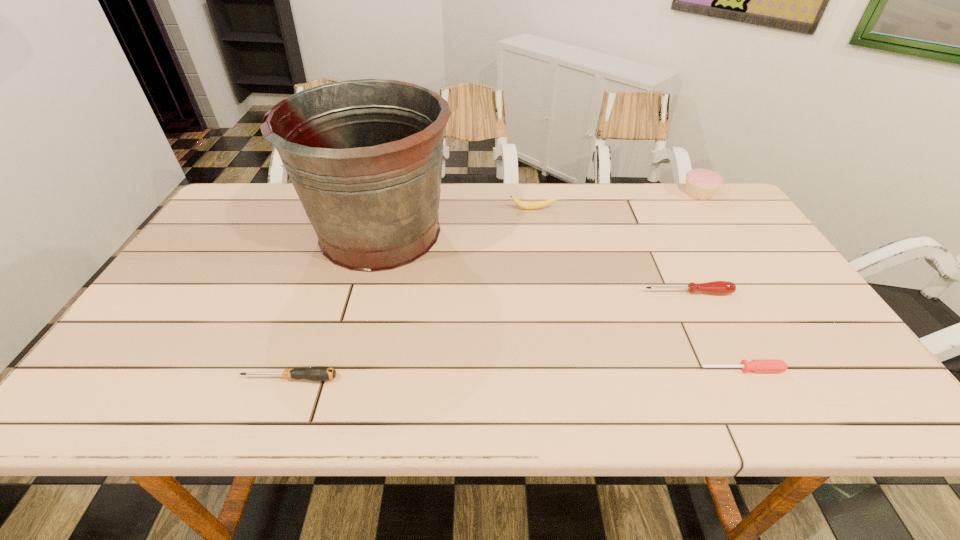
The width and height of the screenshot is (960, 540). In order to click on vacant point that satisfies the following two spatial constraints: 1. on the upward curve of the third object from left to right; 2. on the right side of the farthest screwdriver in this screenshot , I will do `click(545, 293)`.

Where is `vacant space that satisfies the following two spatial constraints: 1. on the upward curve of the shortest screwdriver; 2. on the left side of the banana`? Image resolution: width=960 pixels, height=540 pixels. vacant space that satisfies the following two spatial constraints: 1. on the upward curve of the shortest screwdriver; 2. on the left side of the banana is located at coordinates (558, 369).